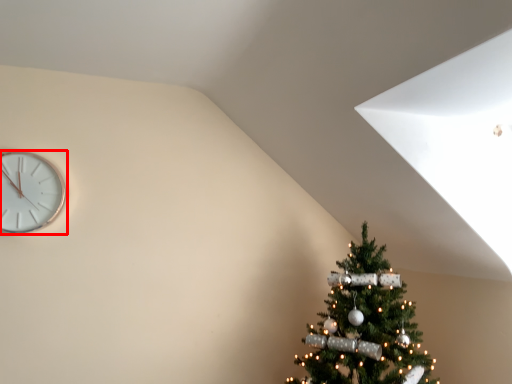
Question: From the image's perspective, where is wall clock (annotated by the red box) located in relation to christmas tree in the image?

Choices:
 (A) above
 (B) below

Answer: (A)